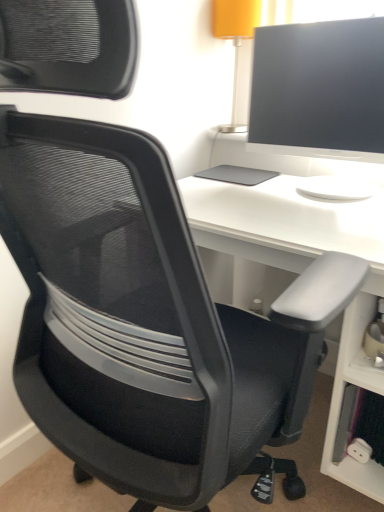
Identify the location of vacant area on the back side of matte black monitor at upper right. (276, 172).